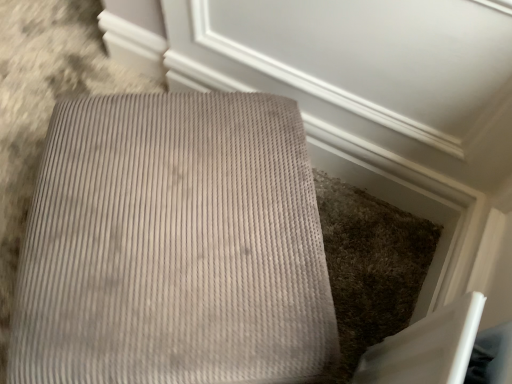
Find the location of a particular element. This screenshot has height=384, width=512. beige corduroy ottoman at center is located at coordinates click(174, 246).

Image resolution: width=512 pixels, height=384 pixels. What do you see at coordinates (174, 246) in the screenshot?
I see `beige corduroy ottoman at center` at bounding box center [174, 246].

This screenshot has height=384, width=512. Describe the element at coordinates (371, 60) in the screenshot. I see `matte gray carpet at upper center` at that location.

At what (x,y) coordinates should I click in order to perform the action: click on matte gray carpet at upper center. Please return your answer as a coordinate pair (x, y). Looking at the image, I should click on (371, 60).

The image size is (512, 384). Identify the location of beige corduroy ottoman at center. (174, 246).

Can you confirm if matte gray carpet at upper center is positioned to the right of beige corduroy ottoman at center?

Indeed, matte gray carpet at upper center is positioned on the right side of beige corduroy ottoman at center.

Relative to beige corduroy ottoman at center, is matte gray carpet at upper center in front or behind?

matte gray carpet at upper center is behind beige corduroy ottoman at center.

Is point (378, 115) positioned behind point (192, 284)?

That is True.

From the image's perspective, is matte gray carpet at upper center over beige corduroy ottoman at center?

Yes, from the image's perspective, matte gray carpet at upper center is on top of beige corduroy ottoman at center.

From a real-world perspective, is matte gray carpet at upper center physically located above or below beige corduroy ottoman at center?

In terms of real-world spatial position, matte gray carpet at upper center is above beige corduroy ottoman at center.

Can you confirm if matte gray carpet at upper center is wider than beige corduroy ottoman at center?

Incorrect, the width of matte gray carpet at upper center does not surpass that of beige corduroy ottoman at center.

In the scene shown: Who is taller, matte gray carpet at upper center or beige corduroy ottoman at center?

matte gray carpet at upper center.

Is matte gray carpet at upper center bigger than beige corduroy ottoman at center?

Incorrect, matte gray carpet at upper center is not larger than beige corduroy ottoman at center.

Is matte gray carpet at upper center not inside beige corduroy ottoman at center?

Absolutely, matte gray carpet at upper center is external to beige corduroy ottoman at center.

Looking at this image, is matte gray carpet at upper center beside beige corduroy ottoman at center?

No, matte gray carpet at upper center is not next to beige corduroy ottoman at center.

Could you tell me if matte gray carpet at upper center is turned towards beige corduroy ottoman at center?

Yes.

I want to click on furniture lying on the left of matte gray carpet at upper center, so click(174, 246).

Considering the positions of objects beige corduroy ottoman at center and matte gray carpet at upper center in the image provided, who is more to the left, beige corduroy ottoman at center or matte gray carpet at upper center?

beige corduroy ottoman at center is more to the left.

From the picture: Considering the relative positions of beige corduroy ottoman at center and matte gray carpet at upper center in the image provided, is beige corduroy ottoman at center behind matte gray carpet at upper center?

No.

Is point (242, 162) positioned behind point (377, 35)?

No, it is not.

From the image's perspective, is beige corduroy ottoman at center over matte gray carpet at upper center?

No, from the image's perspective, beige corduroy ottoman at center is not on top of matte gray carpet at upper center.

From a real-world perspective, does beige corduroy ottoman at center stand above matte gray carpet at upper center?

No, from a real-world perspective, beige corduroy ottoman at center is not on top of matte gray carpet at upper center.

Between beige corduroy ottoman at center and matte gray carpet at upper center, which one has larger width?

With larger width is beige corduroy ottoman at center.

Can you confirm if beige corduroy ottoman at center is taller than matte gray carpet at upper center?

No.

Considering the sizes of objects beige corduroy ottoman at center and matte gray carpet at upper center in the image provided, who is smaller, beige corduroy ottoman at center or matte gray carpet at upper center?

Smaller between the two is matte gray carpet at upper center.

Can we say beige corduroy ottoman at center lies outside matte gray carpet at upper center?

Yes, beige corduroy ottoman at center is not within matte gray carpet at upper center.

Is beige corduroy ottoman at center far away from matte gray carpet at upper center?

No.

Could you tell me if beige corduroy ottoman at center is facing matte gray carpet at upper center?

No.

How far apart are beige corduroy ottoman at center and matte gray carpet at upper center?

beige corduroy ottoman at center and matte gray carpet at upper center are 16.02 inches apart.

You are a GUI agent. You are given a task and a screenshot of the screen. Output one action in this format:
    pyautogui.click(x=<x>, y=<y>)
    Task: Click on the furniture that is on the left side of matte gray carpet at upper center
    The image size is (512, 384).
    Given the screenshot: What is the action you would take?
    pyautogui.click(x=174, y=246)

The width and height of the screenshot is (512, 384). Find the location of `screen door above the beige corduroy ottoman at center (from the image's perspective)`. screen door above the beige corduroy ottoman at center (from the image's perspective) is located at coordinates point(371,60).

At what (x,y) coordinates should I click in order to perform the action: click on screen door that is above the beige corduroy ottoman at center (from a real-world perspective). Please return your answer as a coordinate pair (x, y). This screenshot has width=512, height=384. Looking at the image, I should click on [371, 60].